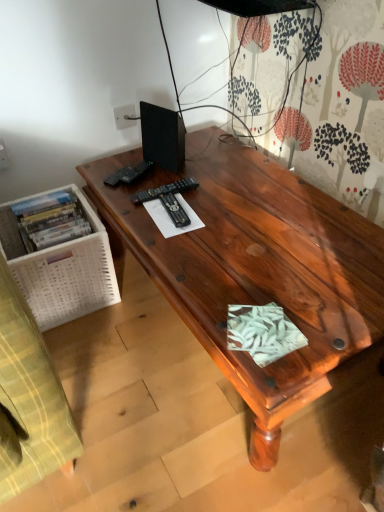
Locate an element on the screen. empty space that is to the right of black plastic remote control at center, acting as the second remote control starting from the front is located at coordinates (222, 194).